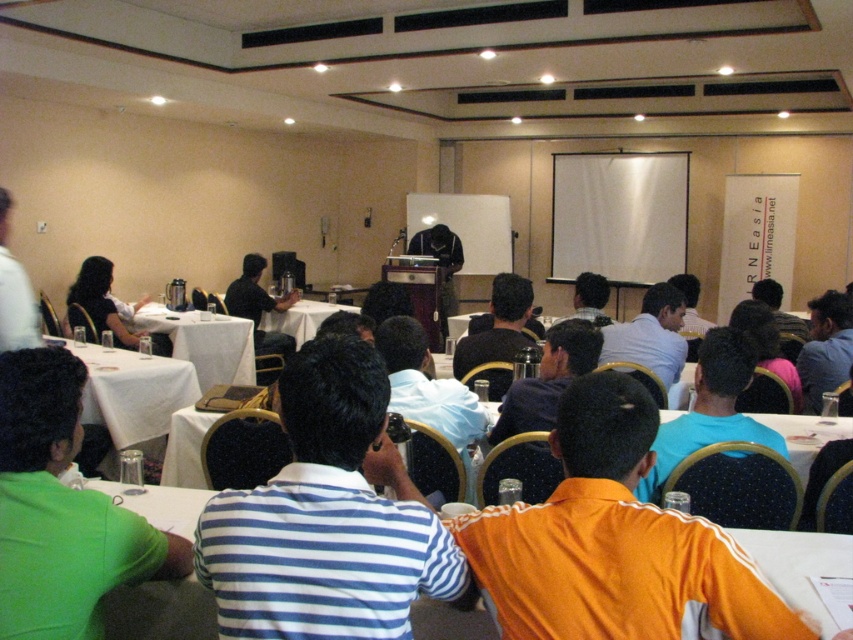
You are attending a conference and see two people in the scene described. One is wearing a blue striped shirt at center and the other has dark hair at upper left. Which person is more to the right side?

The blue striped shirt at center is more to the right side because it is positioned on the right side of dark hair at upper left.

You are sitting at the white plastic table at center and want to hand a document to the person wearing the matte black shirt at center. In which direction should you pass the document?

You should pass the document to the right, since the white plastic table at center is to the left of the matte black shirt at center.

You are organizing a small workshop and need to determine the layout of the room. Based on the image, which object takes up more space in the room, the white plastic table at center or the matte black shirt at center?

The matte black shirt at center occupies more space than the white plastic table at center according to the description.